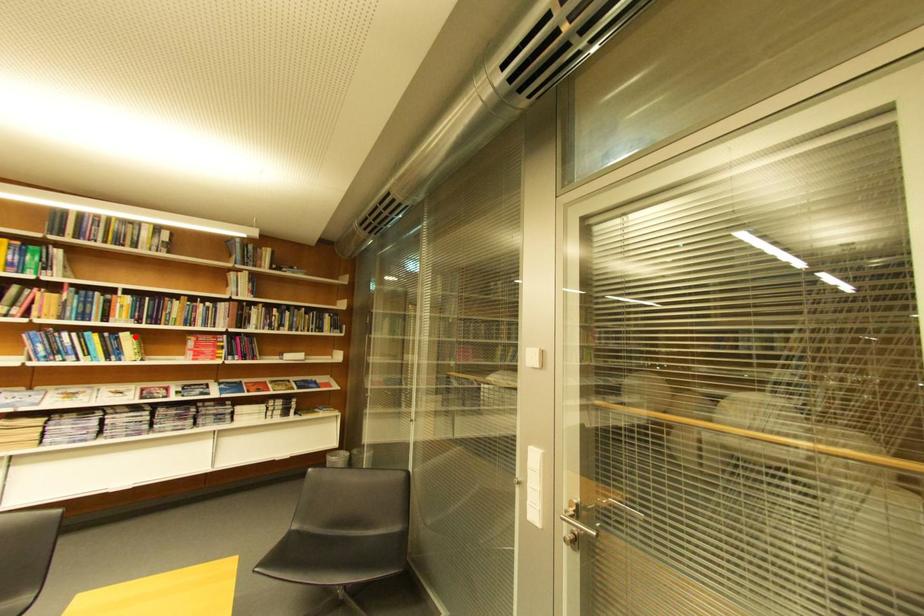
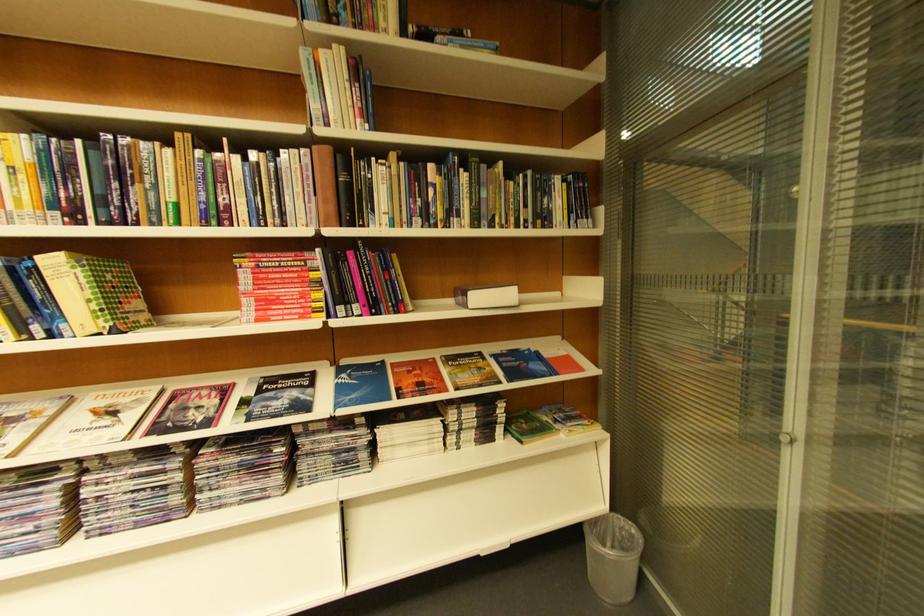
The point at the highlighted location is marked in the first image. Where is the corresponding point in the second image?

(63, 264)